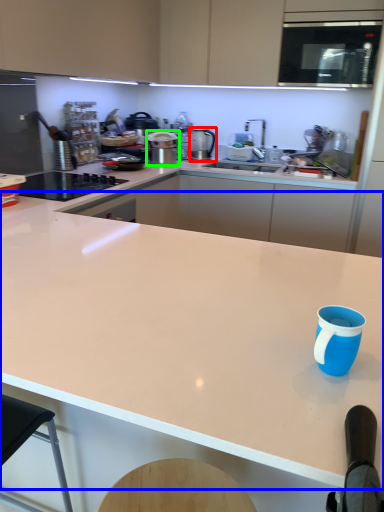
Question: Based on their relative distances, which object is nearer to kitchen appliance (highlighted by a red box)? Choose from countertop (highlighted by a blue box) and kitchen appliance (highlighted by a green box).

Choices:
 (A) countertop
 (B) kitchen appliance

Answer: (B)